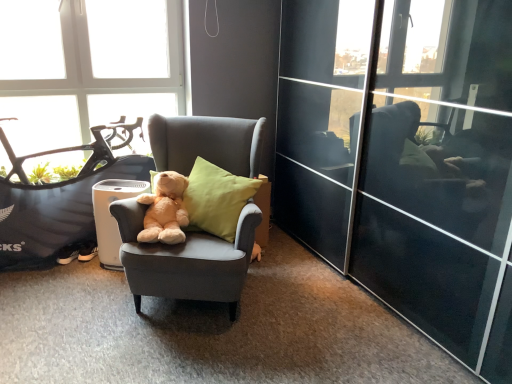
Locate an element on the screen. This screenshot has width=512, height=384. vacant space in front of matte gray armchair at center is located at coordinates (178, 354).